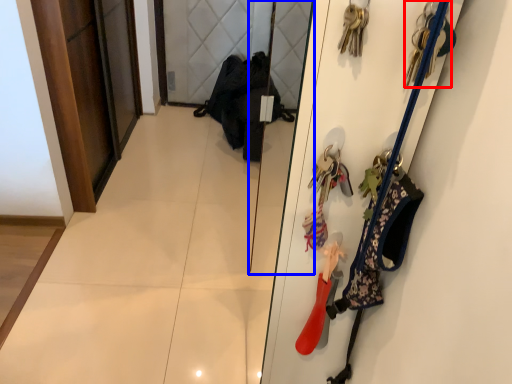
Question: Which of the following is the farthest to the observer, accessory (highlighted by a red box) or mirror (highlighted by a blue box)?

Choices:
 (A) accessory
 (B) mirror

Answer: (B)